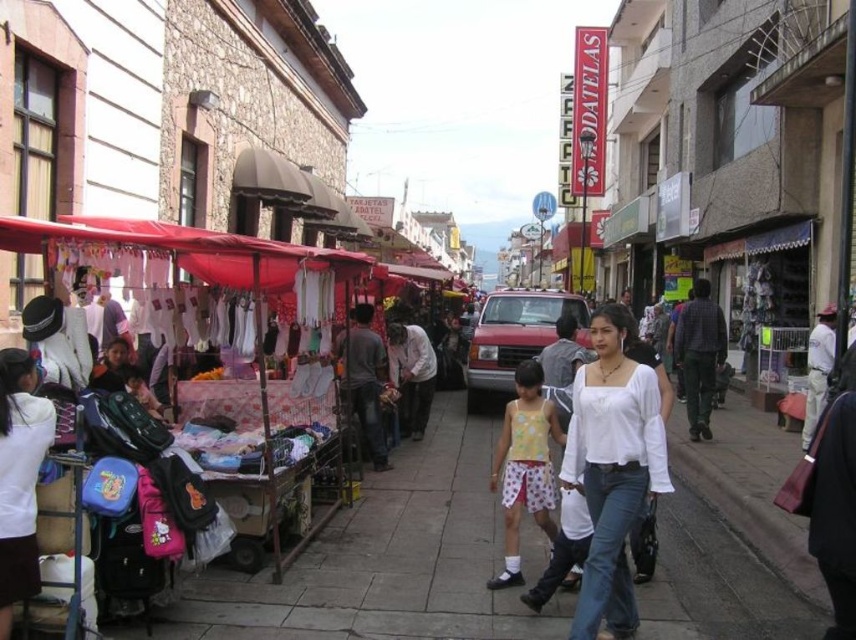
From the picture: Does smooth concrete sidewalk at center appear on the right side of white cotton blouse at center?

No, smooth concrete sidewalk at center is not to the right of white cotton blouse at center.

Which is behind, point (346, 561) or point (569, 436)?

The point (346, 561) is behind.

Does point (403, 554) lie behind point (622, 403)?

Yes, it is.

Locate an element on the screen. smooth concrete sidewalk at center is located at coordinates (383, 561).